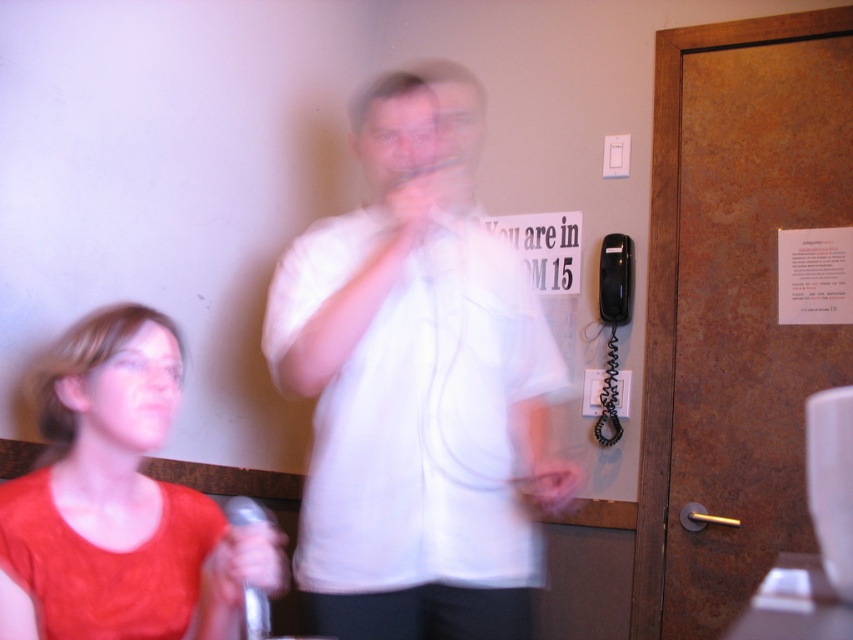
Can you confirm if white matte shirt at center is bigger than matte red shirt at left?

Correct, white matte shirt at center is larger in size than matte red shirt at left.

Can you confirm if white matte shirt at center is positioned to the left of matte red shirt at left?

Incorrect, white matte shirt at center is not on the left side of matte red shirt at left.

Is point (527, 301) behind point (157, 509)?

That is True.

The image size is (853, 640). I want to click on white matte shirt at center, so click(416, 388).